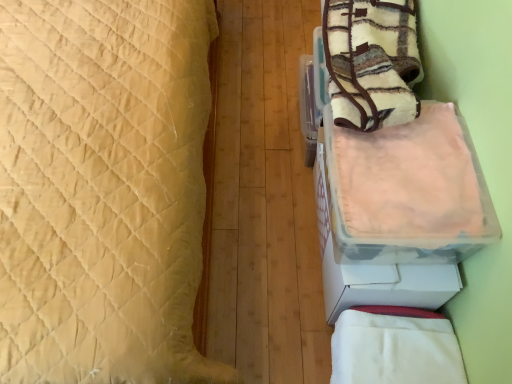
Question: From the image's perspective, is beige quilted bed at left below fluffy fleece blanket at upper right, the 2th blanket ordered from the bottom?

Choices:
 (A) yes
 (B) no

Answer: (A)

Question: Does beige quilted bed at left have a larger size compared to fluffy fleece blanket at upper right, the 1th blanket positioned from the top?

Choices:
 (A) no
 (B) yes

Answer: (B)

Question: Is fluffy fleece blanket at upper right, the 2th blanket ordered from the bottom, surrounded by beige quilted bed at left?

Choices:
 (A) yes
 (B) no

Answer: (B)

Question: From the image's perspective, does beige quilted bed at left appear higher than fluffy fleece blanket at upper right, the 2th blanket ordered from the bottom?

Choices:
 (A) no
 (B) yes

Answer: (A)

Question: From a real-world perspective, is beige quilted bed at left positioned under fluffy fleece blanket at upper right, the 2th blanket ordered from the bottom, based on gravity?

Choices:
 (A) no
 (B) yes

Answer: (B)

Question: Is beige quilted bed at left smaller than fluffy fleece blanket at upper right, the 1th blanket positioned from the top?

Choices:
 (A) yes
 (B) no

Answer: (B)

Question: Would you say fluffy fleece blanket at upper right, the 2th blanket ordered from the bottom, contains white soft blanket at lower right, acting as the second blanket starting from the top?

Choices:
 (A) no
 (B) yes

Answer: (A)

Question: Considering the relative sizes of fluffy fleece blanket at upper right, the 1th blanket positioned from the top, and white soft blanket at lower right, acting as the 1th blanket starting from the bottom, in the image provided, is fluffy fleece blanket at upper right, the 1th blanket positioned from the top, thinner than white soft blanket at lower right, acting as the 1th blanket starting from the bottom,?

Choices:
 (A) yes
 (B) no

Answer: (B)

Question: Can you confirm if fluffy fleece blanket at upper right, the 2th blanket ordered from the bottom, is wider than white soft blanket at lower right, acting as the 1th blanket starting from the bottom?

Choices:
 (A) no
 (B) yes

Answer: (B)

Question: From the image's perspective, is fluffy fleece blanket at upper right, the 1th blanket positioned from the top, below white soft blanket at lower right, acting as the 1th blanket starting from the bottom?

Choices:
 (A) no
 (B) yes

Answer: (A)

Question: From a real-world perspective, is fluffy fleece blanket at upper right, the 1th blanket positioned from the top, physically above white soft blanket at lower right, acting as the second blanket starting from the top?

Choices:
 (A) yes
 (B) no

Answer: (A)

Question: Does fluffy fleece blanket at upper right, the 2th blanket ordered from the bottom, appear on the right side of white soft blanket at lower right, acting as the second blanket starting from the top?

Choices:
 (A) no
 (B) yes

Answer: (B)

Question: Is white soft blanket at lower right, acting as the second blanket starting from the top, closer to the viewer compared to fluffy fleece blanket at upper right, the 1th blanket positioned from the top?

Choices:
 (A) no
 (B) yes

Answer: (A)